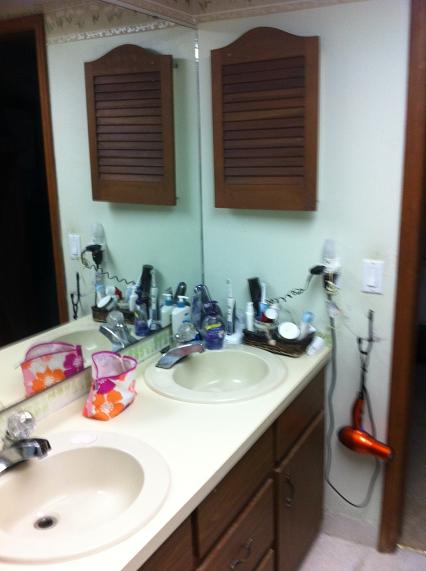
At what (x,y) coordinates should I click in order to perform the action: click on light blue wall. Please return your answer as a coordinate pair (x, y). Looking at the image, I should click on (275, 243).